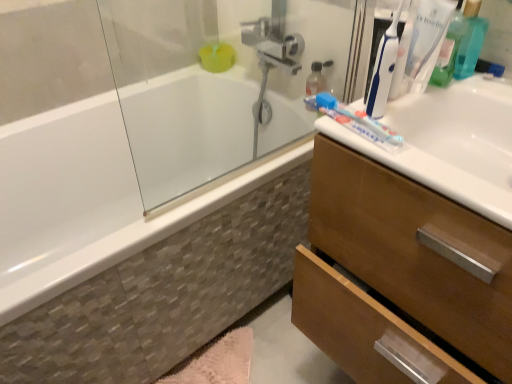
Question: Considering the relative sizes of pink fluffy bath mat at lower center and white glossy bathtub at left in the image provided, is pink fluffy bath mat at lower center bigger than white glossy bathtub at left?

Choices:
 (A) no
 (B) yes

Answer: (A)

Question: Considering the relative sizes of pink fluffy bath mat at lower center and white glossy bathtub at left in the image provided, is pink fluffy bath mat at lower center shorter than white glossy bathtub at left?

Choices:
 (A) yes
 (B) no

Answer: (A)

Question: Can you confirm if pink fluffy bath mat at lower center is smaller than white glossy bathtub at left?

Choices:
 (A) yes
 (B) no

Answer: (A)

Question: Does pink fluffy bath mat at lower center have a greater width compared to white glossy bathtub at left?

Choices:
 (A) no
 (B) yes

Answer: (A)

Question: Is white glossy bathtub at left completely or partially inside pink fluffy bath mat at lower center?

Choices:
 (A) yes
 (B) no

Answer: (B)

Question: Would you say blue plastic toothbrush at upper right, marked as the second toothbrush in a right-to-left arrangement, is to the left or to the right of pink fluffy bath mat at lower center in the picture?

Choices:
 (A) left
 (B) right

Answer: (B)

Question: From the image's perspective, is blue plastic toothbrush at upper right, acting as the 1th toothbrush starting from the left, located above or below pink fluffy bath mat at lower center?

Choices:
 (A) below
 (B) above

Answer: (B)

Question: Considering the positions of blue plastic toothbrush at upper right, acting as the 1th toothbrush starting from the left, and pink fluffy bath mat at lower center in the image, is blue plastic toothbrush at upper right, acting as the 1th toothbrush starting from the left, taller or shorter than pink fluffy bath mat at lower center?

Choices:
 (A) short
 (B) tall

Answer: (B)

Question: In terms of size, does blue plastic toothbrush at upper right, marked as the second toothbrush in a right-to-left arrangement, appear bigger or smaller than pink fluffy bath mat at lower center?

Choices:
 (A) big
 (B) small

Answer: (B)

Question: From a real-world perspective, is pink fluffy bath mat at lower center positioned above or below wooden cabinet at right?

Choices:
 (A) below
 (B) above

Answer: (A)

Question: Is point (174, 372) positioned closer to the camera than point (368, 188)?

Choices:
 (A) farther
 (B) closer

Answer: (A)

Question: Looking at their shapes, would you say pink fluffy bath mat at lower center is wider or thinner than wooden cabinet at right?

Choices:
 (A) thin
 (B) wide

Answer: (A)

Question: Is pink fluffy bath mat at lower center in front of or behind wooden cabinet at right in the image?

Choices:
 (A) front
 (B) behind

Answer: (B)

Question: In terms of size, does wooden cabinet at right appear bigger or smaller than translucent plastic toothbrush at upper right, the second toothbrush in the left-to-right sequence?

Choices:
 (A) small
 (B) big

Answer: (B)

Question: From the image's perspective, is wooden cabinet at right positioned above or below translucent plastic toothbrush at upper right, the second toothbrush in the left-to-right sequence?

Choices:
 (A) below
 (B) above

Answer: (A)